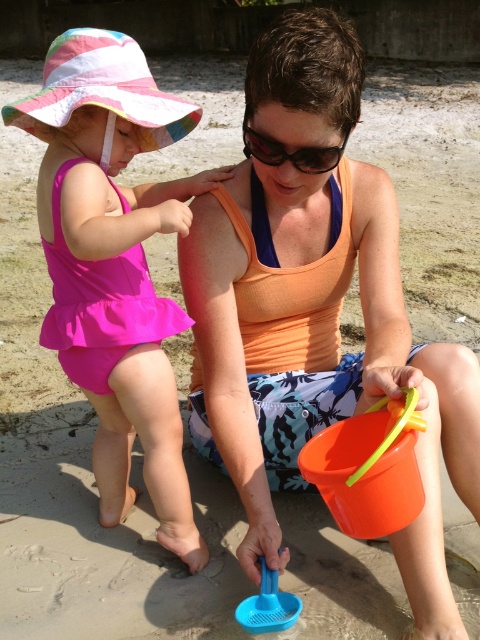
Question: Among these objects, which one is farthest from the camera?

Choices:
 (A) black plastic goggles at upper center
 (B) pink fabric swimsuit at left

Answer: (B)

Question: Among these objects, which one is farthest from the camera?

Choices:
 (A) orange plastic bucket at lower center
 (B) orange fabric tank top at center
 (C) pink fabric swimsuit at left
 (D) blue plastic sieve at lower center

Answer: (D)

Question: Can you confirm if pink fabric swimsuit at left is thinner than orange plastic bucket at lower center?

Choices:
 (A) yes
 (B) no

Answer: (B)

Question: Does pink fabric swimsuit at left have a larger size compared to orange plastic bucket at lower center?

Choices:
 (A) no
 (B) yes

Answer: (B)

Question: Which point is farther to the camera?

Choices:
 (A) click(288, 273)
 (B) click(386, 438)
 (C) click(260, 154)
 (D) click(285, 612)

Answer: (A)

Question: Does orange fabric tank top at center lie in front of pink fabric swimsuit at left?

Choices:
 (A) no
 (B) yes

Answer: (B)